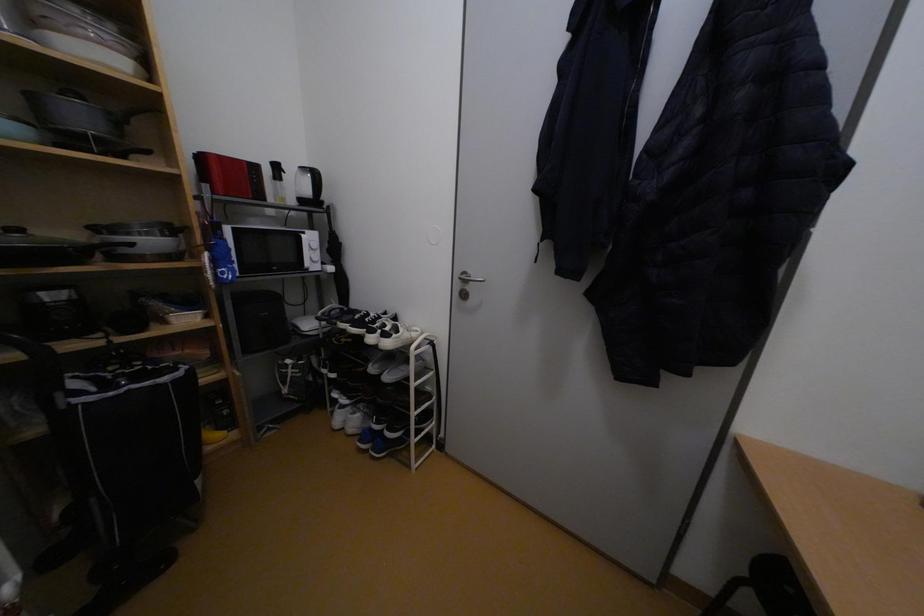
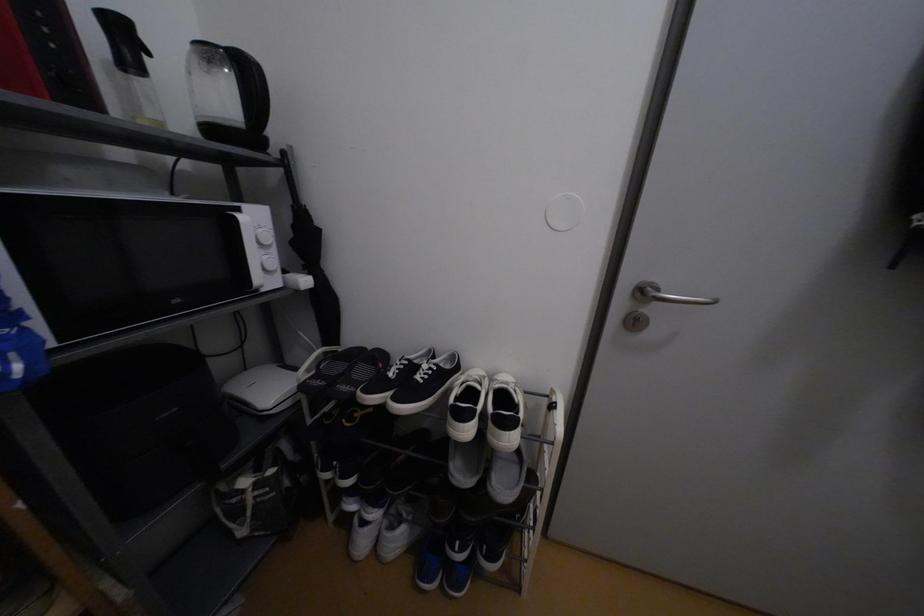
Question: The camera is either moving clockwise (left) or counter-clockwise (right) around the object. The first image is from the beginning of the video and the second image is from the end. Is the camera moving left or right when shooting the video?

Choices:
 (A) Left
 (B) Right

Answer: (A)